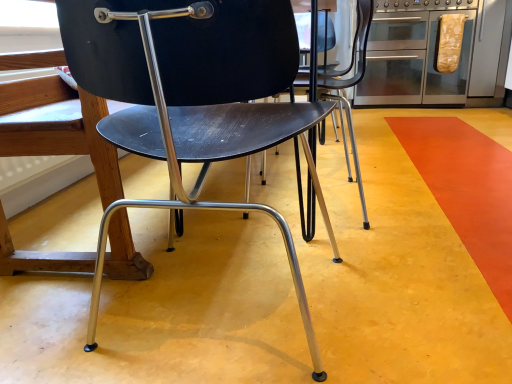
Question: Should I look upward or downward to see metallic stainless steel oven at upper right?

Choices:
 (A) down
 (B) up

Answer: (B)

Question: Is matte black chair at center to the right of metallic stainless steel oven at upper right from the viewer's perspective?

Choices:
 (A) no
 (B) yes

Answer: (A)

Question: From a real-world perspective, is matte black chair at center over metallic stainless steel oven at upper right?

Choices:
 (A) no
 (B) yes

Answer: (A)

Question: Is matte black chair at center in front of metallic stainless steel oven at upper right?

Choices:
 (A) yes
 (B) no

Answer: (A)

Question: From the image's perspective, is matte black chair at center located above metallic stainless steel oven at upper right?

Choices:
 (A) no
 (B) yes

Answer: (A)

Question: Is metallic stainless steel oven at upper right inside matte black chair at center?

Choices:
 (A) no
 (B) yes

Answer: (A)

Question: From the image's perspective, is matte black chair at center located beneath metallic stainless steel oven at upper right?

Choices:
 (A) yes
 (B) no

Answer: (A)

Question: Can you confirm if metallic stainless steel oven at upper right is positioned to the left of matte black chair at center?

Choices:
 (A) yes
 (B) no

Answer: (B)

Question: Is metallic stainless steel oven at upper right aimed at matte black chair at center?

Choices:
 (A) no
 (B) yes

Answer: (B)

Question: Are metallic stainless steel oven at upper right and matte black chair at center beside each other?

Choices:
 (A) yes
 (B) no

Answer: (B)

Question: From the image's perspective, is metallic stainless steel oven at upper right below matte black chair at center?

Choices:
 (A) yes
 (B) no

Answer: (B)

Question: Is metallic stainless steel oven at upper right far away from matte black chair at center?

Choices:
 (A) yes
 (B) no

Answer: (A)

Question: Considering the relative positions of metallic stainless steel oven at upper right and matte black chair at center in the image provided, is metallic stainless steel oven at upper right to the right of matte black chair at center from the viewer's perspective?

Choices:
 (A) no
 (B) yes

Answer: (B)

Question: Relative to metallic stainless steel oven at upper right, is matte black chair at center in front or behind?

Choices:
 (A) behind
 (B) front

Answer: (B)